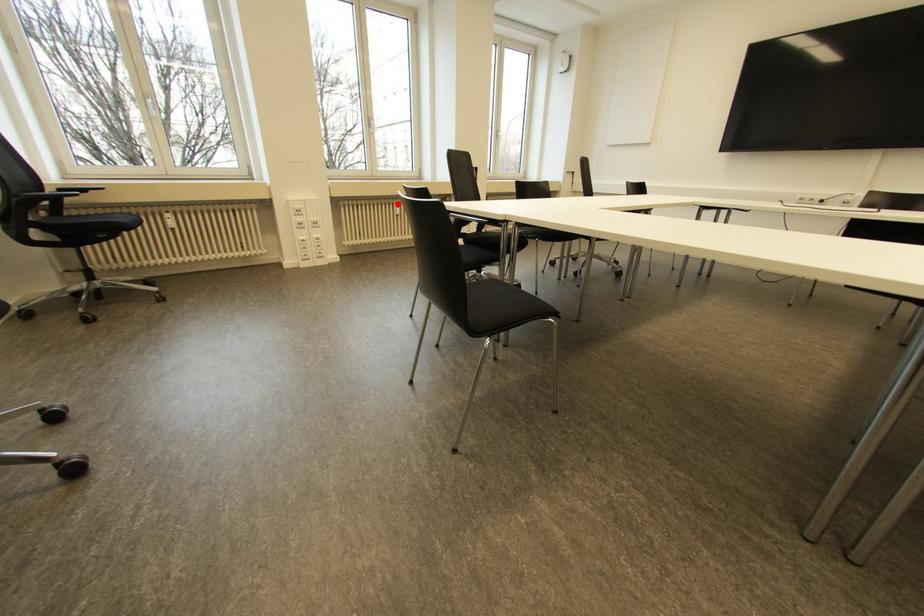
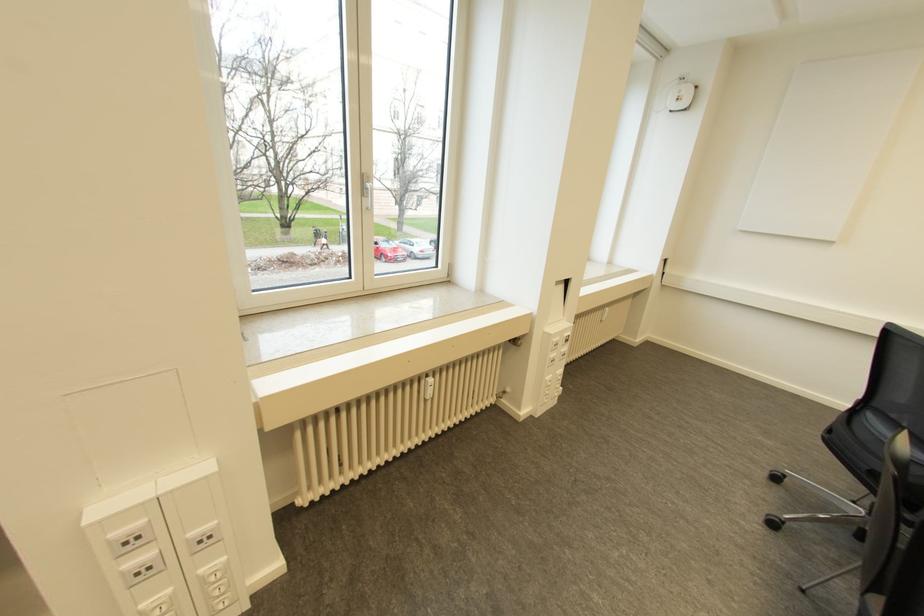
Question: A red point is marked in image1. In image2, is the corresponding 3D point closer to the camera or farther? Reply with the corresponding letter.

Choices:
 (A) The corresponding 3D point is closer.
 (B) The corresponding 3D point is farther.

Answer: (B)